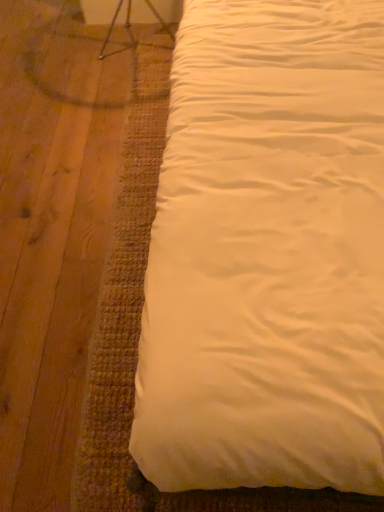
Where is `vacant area situated to the left side of metallic silver swivel chair at upper left`? vacant area situated to the left side of metallic silver swivel chair at upper left is located at coordinates (65, 45).